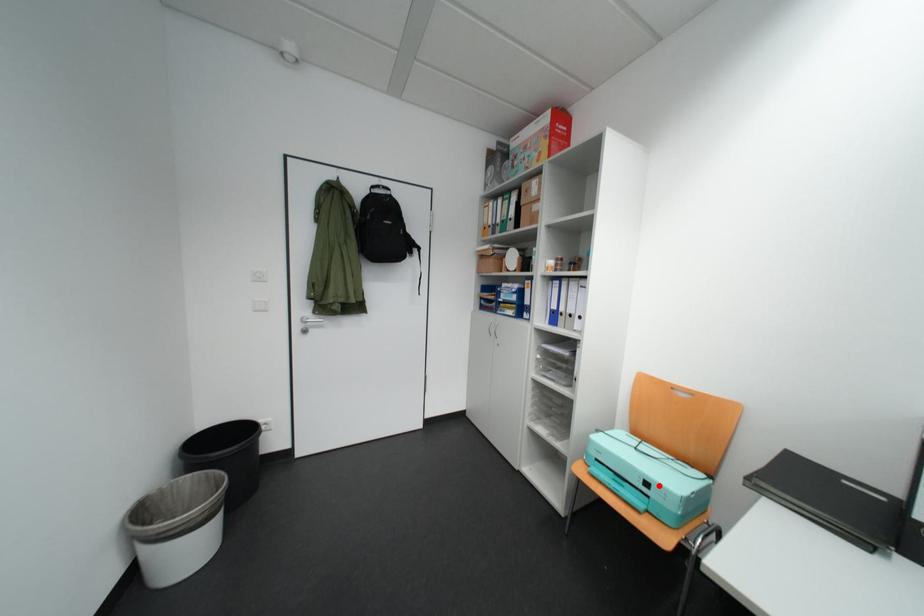
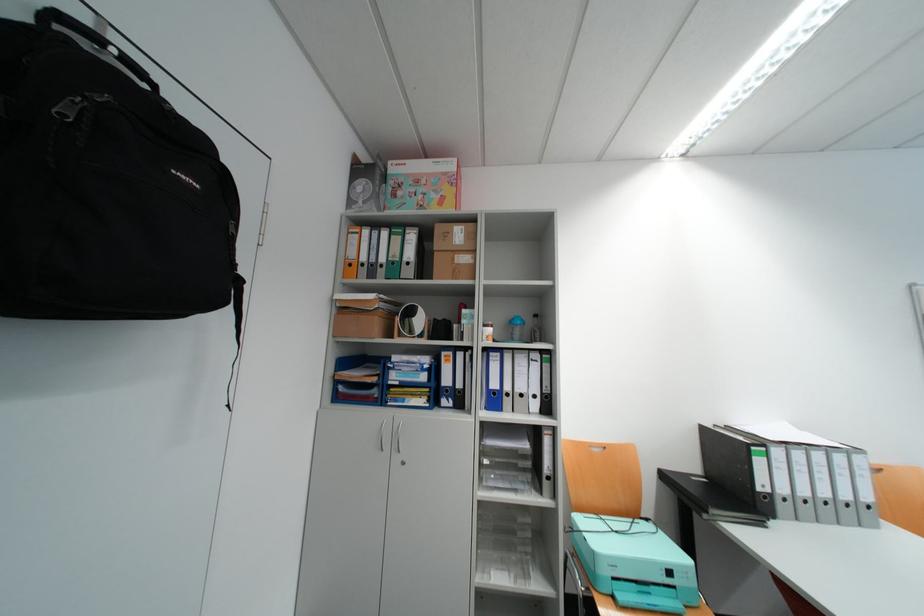
Locate, in the second image, the point that corresponds to the highlighted location in the first image.

(682, 573)